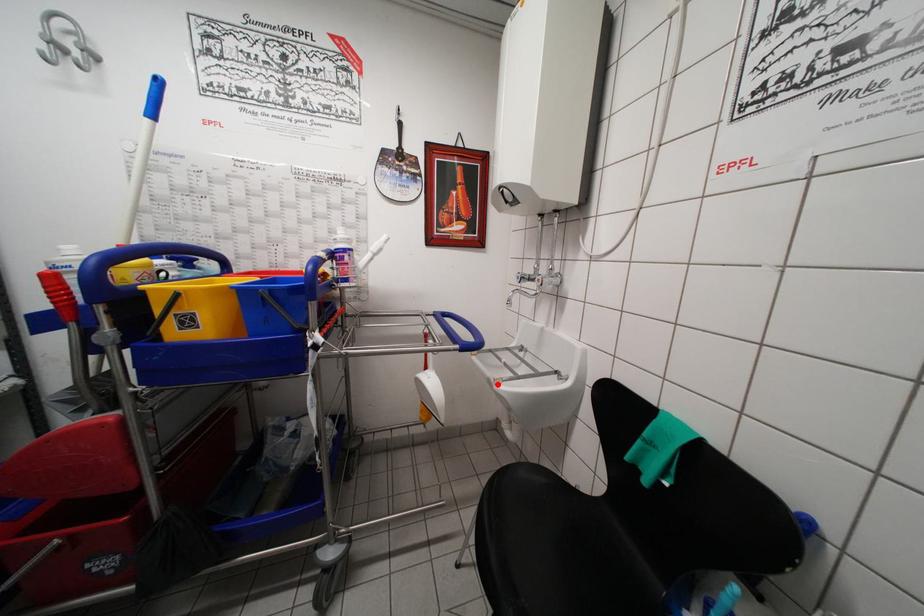
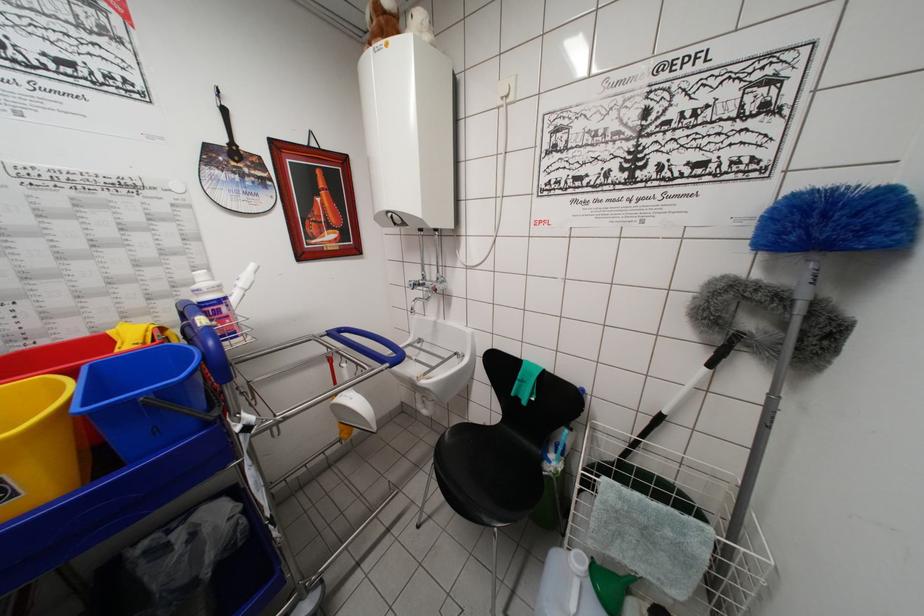
The point at the highlighted location is marked in the first image. Where is the corresponding point in the second image?

(420, 383)